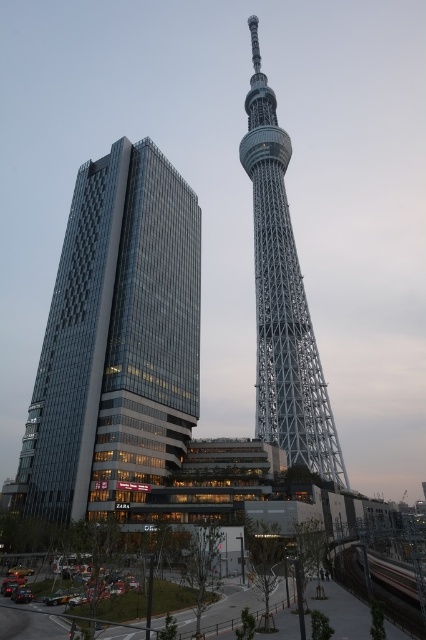
Does glassy modern building at left lie behind silver metallic eiffel tower at center?

No, glassy modern building at left is closer to the viewer.

Which of these two, glassy modern building at left or silver metallic eiffel tower at center, stands shorter?

glassy modern building at left is shorter.

Who is more forward, (x=48, y=467) or (x=291, y=348)?

Point (x=48, y=467) is more forward.

Image resolution: width=426 pixels, height=640 pixels. Identify the location of glassy modern building at left. (117, 340).